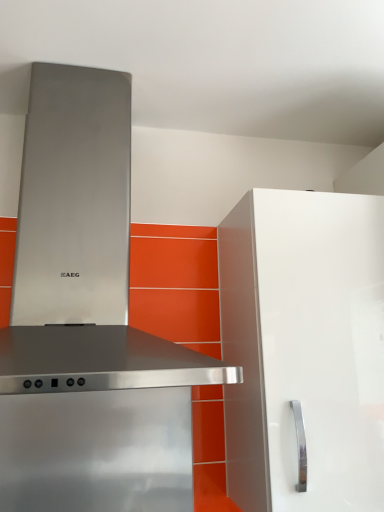
Question: Looking at the image, does white glossy cabinet at right seem bigger or smaller compared to stainless steel range hood at upper left?

Choices:
 (A) big
 (B) small

Answer: (B)

Question: Is white glossy cabinet at right wider or thinner than stainless steel range hood at upper left?

Choices:
 (A) thin
 (B) wide

Answer: (A)

Question: Would you say white glossy cabinet at right is to the left or to the right of stainless steel range hood at upper left in the picture?

Choices:
 (A) right
 (B) left

Answer: (A)

Question: In terms of size, does stainless steel range hood at upper left appear bigger or smaller than white glossy cabinet at right?

Choices:
 (A) big
 (B) small

Answer: (A)

Question: Considering the positions of point (178, 473) and point (228, 485), is point (178, 473) closer or farther from the camera than point (228, 485)?

Choices:
 (A) farther
 (B) closer

Answer: (B)

Question: From a real-world perspective, is stainless steel range hood at upper left physically located above or below white glossy cabinet at right?

Choices:
 (A) below
 (B) above

Answer: (B)

Question: Looking at their shapes, would you say stainless steel range hood at upper left is wider or thinner than white glossy cabinet at right?

Choices:
 (A) thin
 (B) wide

Answer: (B)